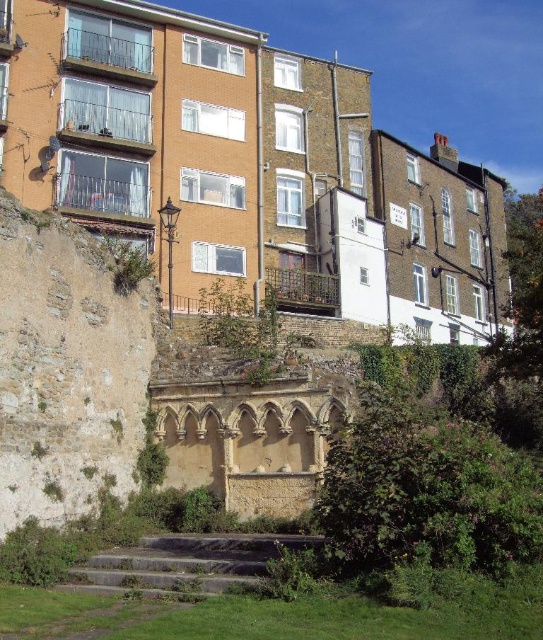
From the picture: You are standing on the clear glass balcony at left and want to move to the clear glass balcony at upper left. Which direction should you move to reach it?

You should move upward to reach the clear glass balcony at upper left since it is located above the clear glass balcony at left.

You are a drone operator who needs to fly a drone from the weathered stone wall at lower left to the metallic silver balcony at upper left. Given that your drone has a maximum flight range of 35 meters, will it be able to reach the balcony without needing to recharge?

The distance between the weathered stone wall at lower left and the metallic silver balcony at upper left is 34.26 meters. Since the drone can fly up to 35 meters, it will be able to reach the balcony without needing to recharge.